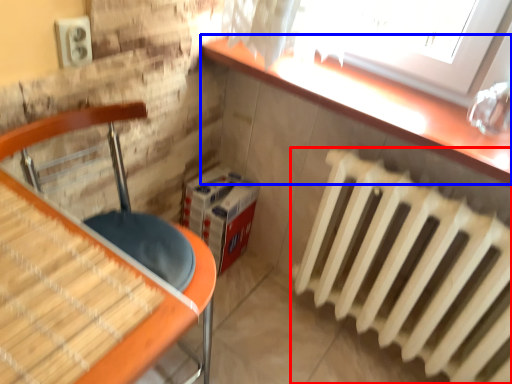
Question: Which object appears farthest to the camera in this image, radiator (highlighted by a red box) or counter top (highlighted by a blue box)?

Choices:
 (A) radiator
 (B) counter top

Answer: (B)